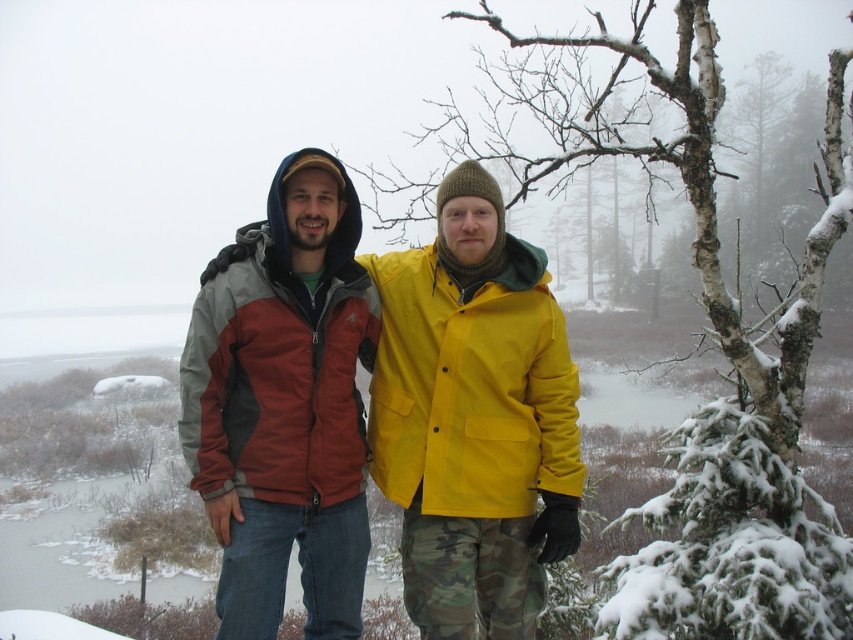
Is matte red jacket at center positioned at the back of matte nylon jacket at center?

No, it is in front of matte nylon jacket at center.

Is matte red jacket at center wider than matte nylon jacket at center?

In fact, matte red jacket at center might be narrower than matte nylon jacket at center.

From the picture: Who is more forward, (x=218, y=317) or (x=439, y=253)?

Point (x=218, y=317) is in front.

This screenshot has width=853, height=640. I want to click on matte red jacket at center, so click(283, 404).